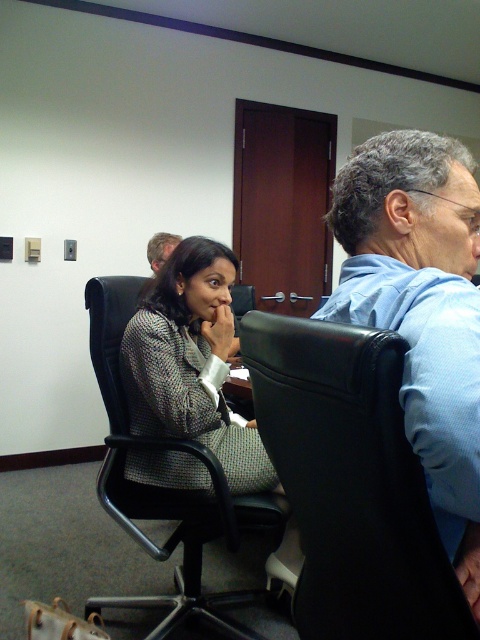
Who is taller, black leather swivel chair at right or blue cotton shirt at right?

Standing taller between the two is blue cotton shirt at right.

Is point (259, 394) positioned in front of point (372, 177)?

Yes, point (259, 394) is closer to viewer.

Which is in front, point (343, 573) or point (444, 545)?

Point (444, 545)

Locate an element on the screen. black leather swivel chair at right is located at coordinates (350, 483).

Is blue cotton shirt at right further to the viewer compared to light brown hair at upper left?

No, it is not.

Where is `blue cotton shirt at right`? The height and width of the screenshot is (640, 480). blue cotton shirt at right is located at coordinates (420, 308).

Does patterned fabric jacket at center have a greater height compared to light brown hair at upper left?

Correct, patterned fabric jacket at center is much taller as light brown hair at upper left.

Consider the image. Is patterned fabric jacket at center shorter than light brown hair at upper left?

Incorrect, patterned fabric jacket at center's height does not fall short of light brown hair at upper left's.

Is point (175, 417) positioned behind point (156, 269)?

No.

What are the coordinates of `patterned fabric jacket at center` in the screenshot? It's located at (191, 362).